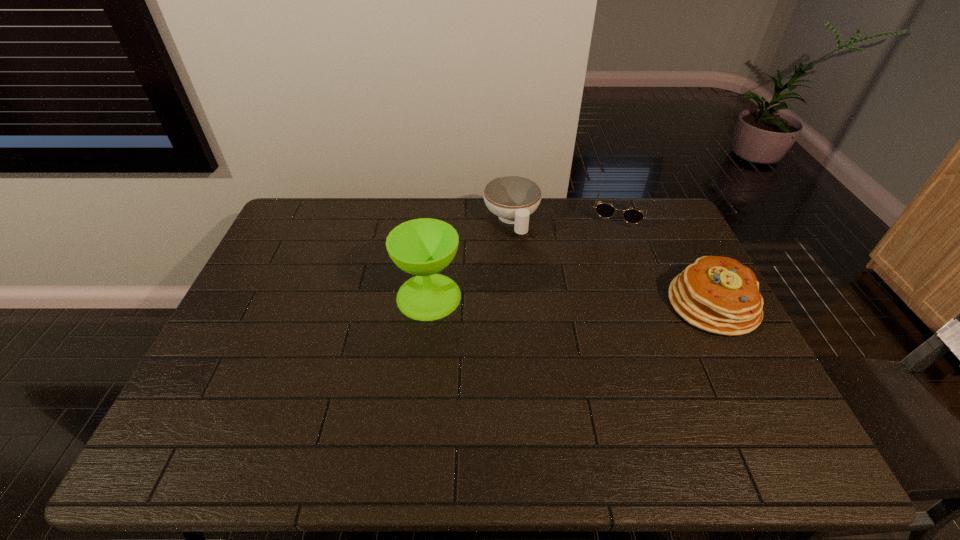
This screenshot has height=540, width=960. Identify the location of vacant spot on the desktop that is between the tallest object and the pancake and is positioned on the front lenses of the shortest object. (595, 301).

This screenshot has height=540, width=960. Find the location of `vacant space on the desktop that is between the tallest object and the pancake and is positioned on the side with the handle of the second object from left to right`. vacant space on the desktop that is between the tallest object and the pancake and is positioned on the side with the handle of the second object from left to right is located at coordinates (544, 300).